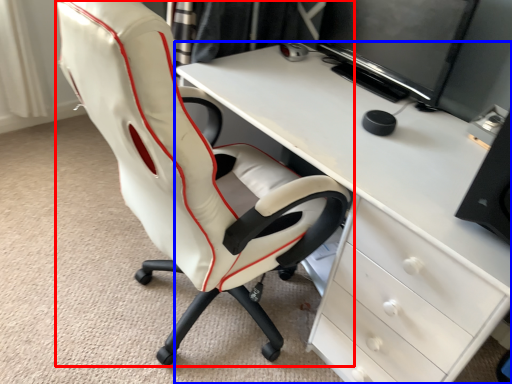
Question: Which object is further to the camera taking this photo, chair (highlighted by a red box) or desk (highlighted by a blue box)?

Choices:
 (A) chair
 (B) desk

Answer: (B)